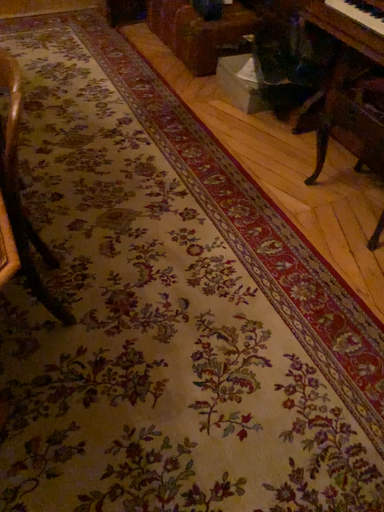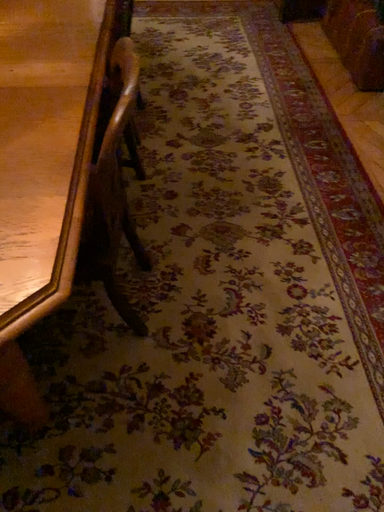
Question: How did the camera likely rotate when shooting the video?

Choices:
 (A) rotated left
 (B) rotated right

Answer: (A)